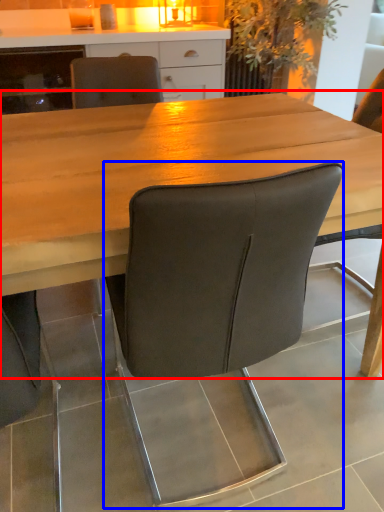
Question: Among these objects, which one is farthest to the camera, table (highlighted by a red box) or chair (highlighted by a blue box)?

Choices:
 (A) table
 (B) chair

Answer: (A)